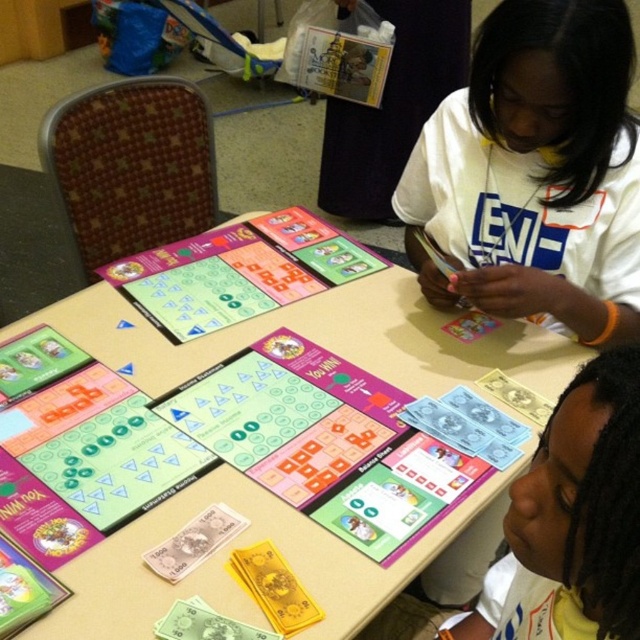
Question: Which point is closer to the camera?

Choices:
 (A) cardboard game board at center
 (B) white matte shirt at upper right

Answer: (A)

Question: Is cardboard game board at center above white matte shirt at upper right?

Choices:
 (A) yes
 (B) no

Answer: (B)

Question: Among these objects, which one is farthest from the camera?

Choices:
 (A) cardboard game board at center
 (B) white matte shirt at upper right

Answer: (B)

Question: Which of the following is the farthest from the observer?

Choices:
 (A) (49, 400)
 (B) (596, 120)

Answer: (A)

Question: Is cardboard game board at center bigger than white matte shirt at upper right?

Choices:
 (A) yes
 (B) no

Answer: (A)

Question: Is cardboard game board at center wider than white matte shirt at upper right?

Choices:
 (A) yes
 (B) no

Answer: (A)